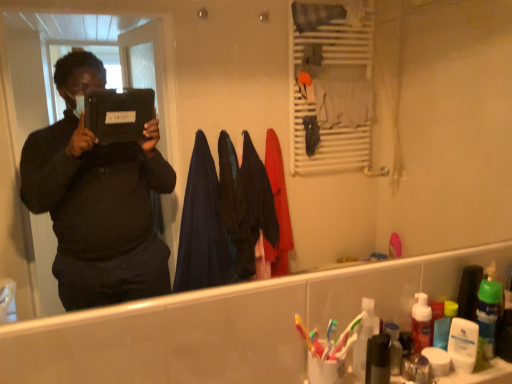
Image resolution: width=512 pixels, height=384 pixels. I want to click on multicolored plastic toothbrush at lower right, so 303,331.

Measure the distance between point (417,380) and camera.

Point (417,380) is 39.25 inches from camera.

Describe the element at coordinates (463, 344) in the screenshot. The width and height of the screenshot is (512, 384). I see `white matte lotion at lower right, arranged as the third toiletry when viewed from the left` at that location.

Locate an element on the screen. The image size is (512, 384). multicolored plastic toothbrush at lower right is located at coordinates (303, 331).

Which of these two, metallic silver soap dispenser at lower right, which is counted as the 2th toiletry, starting from the left, or translucent plastic toothbrushes at lower right, arranged as the 3th toiletry when viewed from the right, is wider?

translucent plastic toothbrushes at lower right, arranged as the 3th toiletry when viewed from the right, is wider.

From the image's perspective, is metallic silver soap dispenser at lower right, positioned as the second toiletry in right-to-left order, located above translucent plastic toothbrushes at lower right, which is the first toiletry from left to right?

Actually, metallic silver soap dispenser at lower right, positioned as the second toiletry in right-to-left order, appears below translucent plastic toothbrushes at lower right, which is the first toiletry from left to right, in the image.

Is metallic silver soap dispenser at lower right, positioned as the second toiletry in right-to-left order, shorter than translucent plastic toothbrushes at lower right, which is the first toiletry from left to right?

Yes, metallic silver soap dispenser at lower right, positioned as the second toiletry in right-to-left order, is shorter than translucent plastic toothbrushes at lower right, which is the first toiletry from left to right.

From the image's perspective, between multicolored plastic toothbrush at lower right and translucent plastic toothbrushes at lower right, which is the first toiletry from left to right, who is located below?

translucent plastic toothbrushes at lower right, which is the first toiletry from left to right, appears lower in the image.

Which of these two, multicolored plastic toothbrush at lower right or translucent plastic toothbrushes at lower right, arranged as the 3th toiletry when viewed from the right, is wider?

With larger width is translucent plastic toothbrushes at lower right, arranged as the 3th toiletry when viewed from the right.

Do you think multicolored plastic toothbrush at lower right is within translucent plastic toothbrushes at lower right, arranged as the 3th toiletry when viewed from the right, or outside of it?

multicolored plastic toothbrush at lower right exists outside the volume of translucent plastic toothbrushes at lower right, arranged as the 3th toiletry when viewed from the right.

Is multicolored plastic toothbrush at lower right oriented away from translucent plastic toothbrushes at lower right, which is the first toiletry from left to right?

No, multicolored plastic toothbrush at lower right is not facing the opposite direction of translucent plastic toothbrushes at lower right, which is the first toiletry from left to right.

In the image, is metallic silver soap dispenser at lower right, positioned as the second toiletry in right-to-left order, positioned in front of or behind multicolored plastic toothbrush at lower right?

In the image, metallic silver soap dispenser at lower right, positioned as the second toiletry in right-to-left order, appears behind multicolored plastic toothbrush at lower right.

Can you confirm if metallic silver soap dispenser at lower right, positioned as the second toiletry in right-to-left order, is positioned to the left of multicolored plastic toothbrush at lower right?

Incorrect, metallic silver soap dispenser at lower right, positioned as the second toiletry in right-to-left order, is not on the left side of multicolored plastic toothbrush at lower right.

From the image's perspective, which one is positioned higher, metallic silver soap dispenser at lower right, which is counted as the 2th toiletry, starting from the left, or multicolored plastic toothbrush at lower right?

multicolored plastic toothbrush at lower right.

Does metallic silver soap dispenser at lower right, which is counted as the 2th toiletry, starting from the left, have a lesser height compared to multicolored plastic toothbrush at lower right?

Yes.

Choose the correct answer: Is translucent plastic toothbrushes at lower right, arranged as the 3th toiletry when viewed from the right, inside metallic silver soap dispenser at lower right, which is counted as the 2th toiletry, starting from the left, or outside it?

translucent plastic toothbrushes at lower right, arranged as the 3th toiletry when viewed from the right, is not inside metallic silver soap dispenser at lower right, which is counted as the 2th toiletry, starting from the left, it's outside.

Can you confirm if translucent plastic toothbrushes at lower right, arranged as the 3th toiletry when viewed from the right, is positioned to the right of metallic silver soap dispenser at lower right, which is counted as the 2th toiletry, starting from the left?

No.

Is translucent plastic toothbrushes at lower right, arranged as the 3th toiletry when viewed from the right, directly adjacent to metallic silver soap dispenser at lower right, positioned as the second toiletry in right-to-left order?

They are not placed beside each other.

Locate an element on the screen. toiletry on the right of metallic silver soap dispenser at lower right, which is counted as the 2th toiletry, starting from the left is located at coordinates (463, 344).

Considering the sizes of objects metallic silver soap dispenser at lower right, positioned as the second toiletry in right-to-left order, and white matte lotion at lower right, arranged as the third toiletry when viewed from the left, in the image provided, who is thinner, metallic silver soap dispenser at lower right, positioned as the second toiletry in right-to-left order, or white matte lotion at lower right, arranged as the third toiletry when viewed from the left,?

Thinner between the two is white matte lotion at lower right, arranged as the third toiletry when viewed from the left.

Is metallic silver soap dispenser at lower right, which is counted as the 2th toiletry, starting from the left, beside white matte lotion at lower right, which is the first toiletry in right-to-left order?

Yes, the surface of metallic silver soap dispenser at lower right, which is counted as the 2th toiletry, starting from the left, is in contact with white matte lotion at lower right, which is the first toiletry in right-to-left order.

Which object is positioned more to the left, metallic silver soap dispenser at lower right, positioned as the second toiletry in right-to-left order, or white matte lotion at lower right, which is the first toiletry in right-to-left order?

metallic silver soap dispenser at lower right, positioned as the second toiletry in right-to-left order, is more to the left.

Is point (303, 329) farther from viewer compared to point (471, 365)?

No, (303, 329) is closer to viewer.

Would you say multicolored plastic toothbrush at lower right is outside white matte lotion at lower right, which is the first toiletry in right-to-left order?

multicolored plastic toothbrush at lower right is positioned outside white matte lotion at lower right, which is the first toiletry in right-to-left order.

Which object is positioned more to the left, multicolored plastic toothbrush at lower right or white matte lotion at lower right, arranged as the third toiletry when viewed from the left?

multicolored plastic toothbrush at lower right.

What are the coordinates of `toothbrush above the white matte lotion at lower right, which is the first toiletry in right-to-left order (from the image's perspective)` in the screenshot? It's located at click(303, 331).

The image size is (512, 384). Find the location of `the 1st toiletry directly above the metallic silver soap dispenser at lower right, which is counted as the 2th toiletry, starting from the left (from a real-world perspective)`. the 1st toiletry directly above the metallic silver soap dispenser at lower right, which is counted as the 2th toiletry, starting from the left (from a real-world perspective) is located at coordinates (463, 344).

Is white matte lotion at lower right, which is the first toiletry in right-to-left order, wider or thinner than metallic silver soap dispenser at lower right, which is counted as the 2th toiletry, starting from the left?

white matte lotion at lower right, which is the first toiletry in right-to-left order, is thinner than metallic silver soap dispenser at lower right, which is counted as the 2th toiletry, starting from the left.

From the image's perspective, which object appears higher, white matte lotion at lower right, which is the first toiletry in right-to-left order, or metallic silver soap dispenser at lower right, which is counted as the 2th toiletry, starting from the left?

white matte lotion at lower right, which is the first toiletry in right-to-left order, is shown above in the image.

The height and width of the screenshot is (384, 512). I want to click on the 1st toiletry behind the metallic silver soap dispenser at lower right, which is counted as the 2th toiletry, starting from the left, counting from the anchor's position, so click(x=364, y=337).

Identify the location of toiletry that is the 1st one when counting downward from the multicolored plastic toothbrush at lower right (from the image's perspective). (364, 337).

Based on their spatial positions, is multicolored plastic toothbrush at lower right or metallic silver soap dispenser at lower right, which is counted as the 2th toiletry, starting from the left, closer to translucent plastic toothbrushes at lower right, which is the first toiletry from left to right?

multicolored plastic toothbrush at lower right is positioned closer to the anchor translucent plastic toothbrushes at lower right, which is the first toiletry from left to right.

Estimate the real-world distances between objects in this image. Which object is further from metallic silver soap dispenser at lower right, positioned as the second toiletry in right-to-left order, multicolored plastic toothbrush at lower right or white matte lotion at lower right, arranged as the third toiletry when viewed from the left?

multicolored plastic toothbrush at lower right lies further to metallic silver soap dispenser at lower right, positioned as the second toiletry in right-to-left order, than the other object.

Estimate the real-world distances between objects in this image. Which object is further from white matte lotion at lower right, arranged as the third toiletry when viewed from the left, translucent plastic toothbrushes at lower right, arranged as the 3th toiletry when viewed from the right, or metallic silver soap dispenser at lower right, which is counted as the 2th toiletry, starting from the left?

translucent plastic toothbrushes at lower right, arranged as the 3th toiletry when viewed from the right.

Looking at this image, which object lies further to the anchor point multicolored plastic toothbrush at lower right, white matte lotion at lower right, which is the first toiletry in right-to-left order, or translucent plastic toothbrushes at lower right, which is the first toiletry from left to right?

white matte lotion at lower right, which is the first toiletry in right-to-left order, lies further to multicolored plastic toothbrush at lower right than the other object.

From the image, which object appears to be farther from translucent plastic toothbrushes at lower right, which is the first toiletry from left to right, metallic silver soap dispenser at lower right, which is counted as the 2th toiletry, starting from the left, or multicolored plastic toothbrush at lower right?

metallic silver soap dispenser at lower right, which is counted as the 2th toiletry, starting from the left, lies further to translucent plastic toothbrushes at lower right, which is the first toiletry from left to right, than the other object.

Which object lies further to the anchor point multicolored plastic toothbrush at lower right, translucent plastic toothbrushes at lower right, arranged as the 3th toiletry when viewed from the right, or metallic silver soap dispenser at lower right, positioned as the second toiletry in right-to-left order?

metallic silver soap dispenser at lower right, positioned as the second toiletry in right-to-left order.

Looking at the image, which one is located further to white matte lotion at lower right, arranged as the third toiletry when viewed from the left, translucent plastic toothbrushes at lower right, which is the first toiletry from left to right, or multicolored plastic toothbrush at lower right?

multicolored plastic toothbrush at lower right is positioned further to the anchor white matte lotion at lower right, arranged as the third toiletry when viewed from the left.

Estimate the real-world distances between objects in this image. Which object is further from metallic silver soap dispenser at lower right, which is counted as the 2th toiletry, starting from the left, multicolored plastic toothbrush at lower right or translucent plastic toothbrushes at lower right, which is the first toiletry from left to right?

multicolored plastic toothbrush at lower right.

Where is `toiletry between multicolored plastic toothbrush at lower right and metallic silver soap dispenser at lower right, which is counted as the 2th toiletry, starting from the left`? toiletry between multicolored plastic toothbrush at lower right and metallic silver soap dispenser at lower right, which is counted as the 2th toiletry, starting from the left is located at coordinates (364, 337).

Find the location of a particular element. toiletry situated between translucent plastic toothbrushes at lower right, arranged as the 3th toiletry when viewed from the right, and white matte lotion at lower right, arranged as the third toiletry when viewed from the left, from left to right is located at coordinates (416, 368).